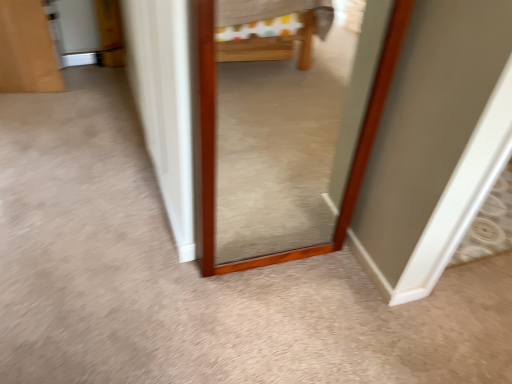
Where is `wooden frame mirror at center`? This screenshot has height=384, width=512. wooden frame mirror at center is located at coordinates (291, 140).

The width and height of the screenshot is (512, 384). What do you see at coordinates (291, 140) in the screenshot?
I see `wooden frame mirror at center` at bounding box center [291, 140].

Identify the location of wooden frame mirror at center. The height and width of the screenshot is (384, 512). (291, 140).